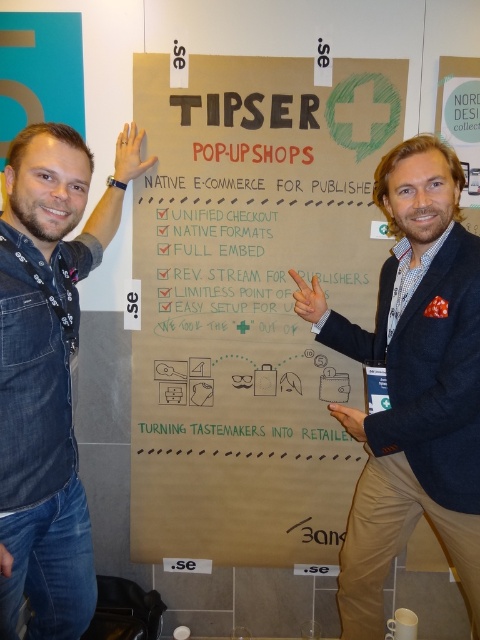
What are the coordinates of the blue denim jeans at center in the image?

The coordinates of the blue denim jeans at center are at point (416, 385).

You are a fashion designer analyzing the outfit of the person in the image. Which item is positioned lower on their body between the blue denim jeans at center and the blue denim shirt at left?

The blue denim jeans at center is located below the blue denim shirt at left, so it is positioned lower on their body.